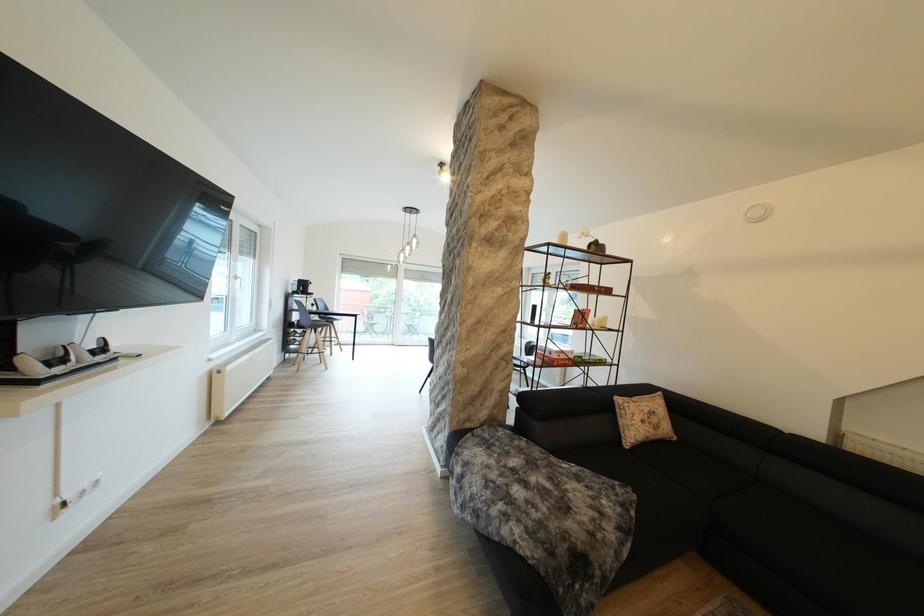
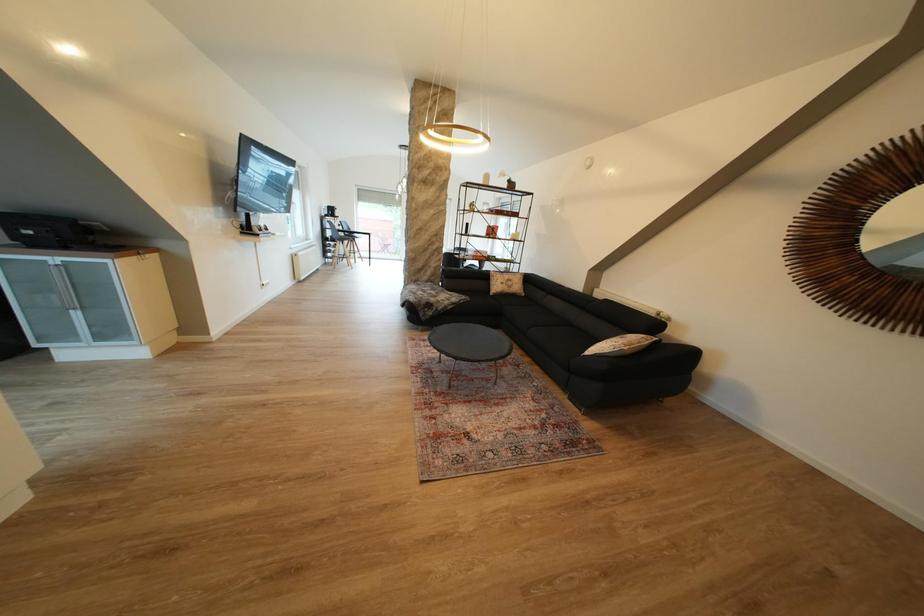
The images are taken continuously from a first-person perspective. In which direction are you moving?

The cameraman walked toward right, backward.